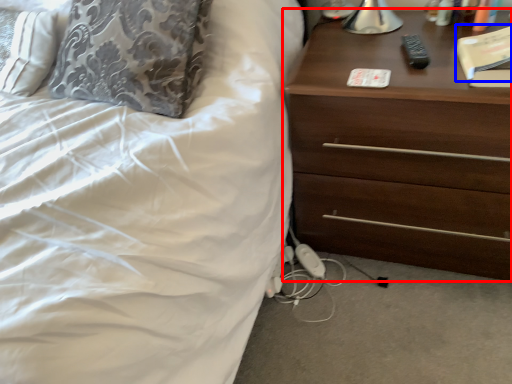
Question: Which point is closer to the camera, chest of drawers (highlighted by a red box) or book (highlighted by a blue box)?

Choices:
 (A) chest of drawers
 (B) book

Answer: (A)